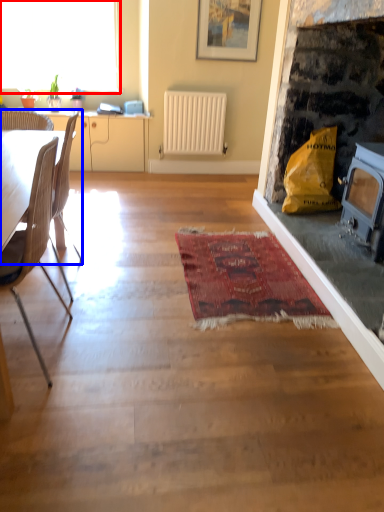
Question: Which of the following is the closest to the observer, window (highlighted by a red box) or chair (highlighted by a blue box)?

Choices:
 (A) window
 (B) chair

Answer: (B)